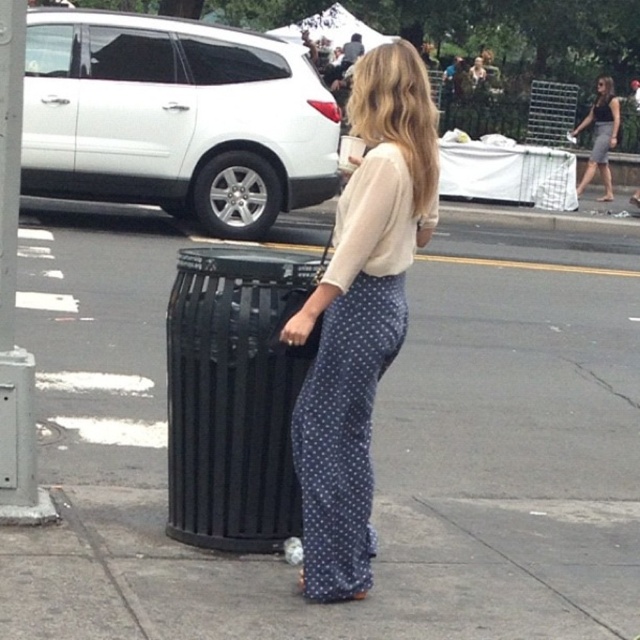
Is matte beige blouse at center to the right of black metal trash can at center from the viewer's perspective?

Correct, you'll find matte beige blouse at center to the right of black metal trash can at center.

Is point (410, 96) positioned after point (204, 531)?

No, it is in front of (204, 531).

Locate an element on the screen. The height and width of the screenshot is (640, 640). matte beige blouse at center is located at coordinates pos(362,314).

Is point (404, 554) farther from viewer compared to point (241, 358)?

Yes, it is behind point (241, 358).

Does smooth asphalt pavement at center have a larger size compared to black metal trash can at center?

Yes, smooth asphalt pavement at center is bigger than black metal trash can at center.

Which is behind, point (10, 561) or point (212, 428)?

Point (212, 428)

You are a GUI agent. You are given a task and a screenshot of the screen. Output one action in this format:
    pyautogui.click(x=<x>, y=<y>)
    Task: Click on the smooth asphalt pavement at center
    The height and width of the screenshot is (640, 640).
    Given the screenshot: What is the action you would take?
    pyautogui.click(x=372, y=445)

Between point (433, 225) and point (605, 120), which one is positioned in front?

Point (433, 225) is more forward.

Between matte beige blouse at center and gray textured skirt at right, which one has less height?

Standing shorter between the two is matte beige blouse at center.

The image size is (640, 640). Describe the element at coordinates (362, 314) in the screenshot. I see `matte beige blouse at center` at that location.

Where is `matte beige blouse at center`? matte beige blouse at center is located at coordinates (362, 314).